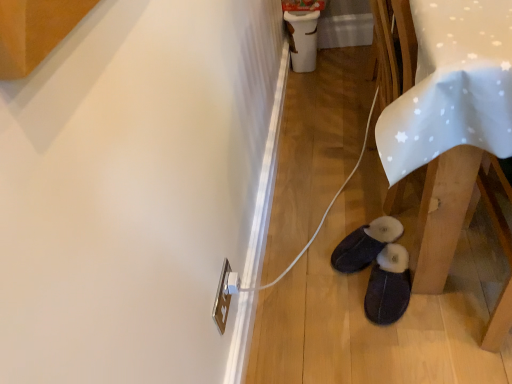
Question: Looking at their shapes, would you say dark suede slippers at lower center, which appears as the second footwear when viewed from the front, is wider or thinner than white fabric table at lower right?

Choices:
 (A) thin
 (B) wide

Answer: (A)

Question: In terms of height, does dark suede slippers at lower center, which appears as the second footwear when viewed from the front, look taller or shorter compared to white fabric table at lower right?

Choices:
 (A) tall
 (B) short

Answer: (B)

Question: Which object is the closest to the white fabric table at lower right?

Choices:
 (A) dark gray suede slippers at lower center, arranged as the 2th footwear when viewed from the back
 (B) dark suede slippers at lower center, the 1th footwear from the back

Answer: (A)

Question: Which of these objects is positioned farthest from the dark gray suede slippers at lower center, arranged as the 2th footwear when viewed from the back?

Choices:
 (A) white fabric table at lower right
 (B) dark suede slippers at lower center, which appears as the second footwear when viewed from the front

Answer: (A)